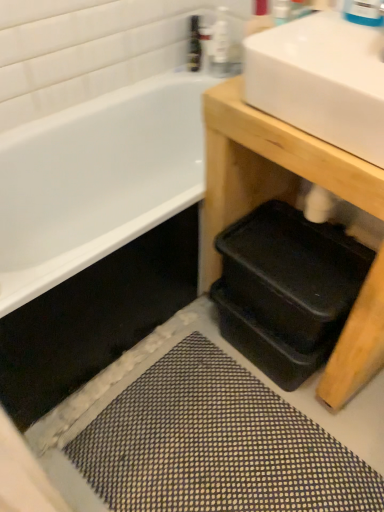
Locate an element on the screen. This screenshot has width=384, height=512. vacant space underneath textured gray bath mat at lower center (from a real-world perspective) is located at coordinates (216, 433).